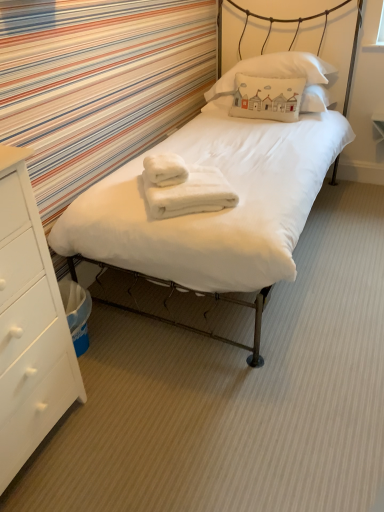
Question: Is white wood chest of drawers at lower left wider or thinner than white soft towel at center, the first bath towel in the right-to-left sequence?

Choices:
 (A) thin
 (B) wide

Answer: (B)

Question: Is white wood chest of drawers at lower left spatially inside white soft towel at center, the first bath towel in the right-to-left sequence, or outside of it?

Choices:
 (A) outside
 (B) inside

Answer: (A)

Question: Estimate the real-world distances between objects in this image. Which object is closer to the white soft towel at center, the first bath towel in the right-to-left sequence?

Choices:
 (A) white wood chest of drawers at lower left
 (B) white matte bed at center
 (C) white cotton pillow at upper center, which is counted as the first pillow, starting from the top
 (D) white soft towel at center, which appears as the 2th bath towel when viewed from the right
 (E) white cotton pillow at center, arranged as the 2th pillow when viewed from the top

Answer: (D)

Question: Which is nearer to the white cotton pillow at center, which is counted as the first pillow, starting from the bottom?

Choices:
 (A) white soft towel at center, positioned as the 2th bath towel in left-to-right order
 (B) white wood chest of drawers at lower left
 (C) white matte bed at center
 (D) white cotton pillow at upper center, which is counted as the first pillow, starting from the top
 (E) white soft towel at center, which appears as the 2th bath towel when viewed from the right

Answer: (D)